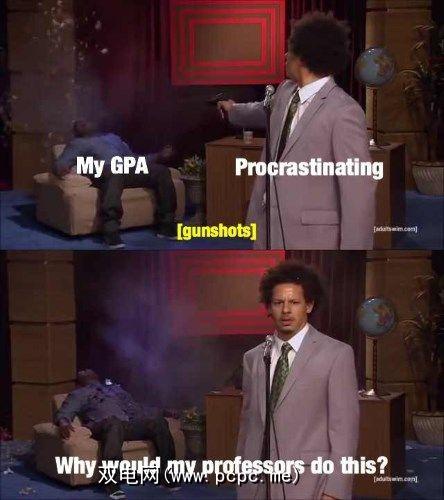
In order to click on desk in this screenshot , I will do `click(235, 185)`, `click(222, 424)`.